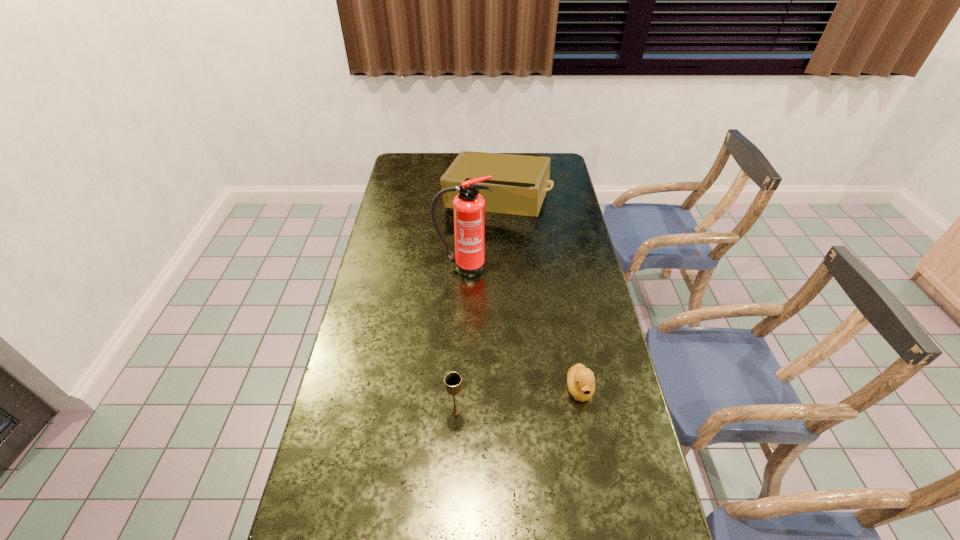
Image resolution: width=960 pixels, height=540 pixels. In order to click on the second farthest object in this screenshot , I will do `click(468, 206)`.

At what (x,y) coordinates should I click in order to perform the action: click on the tallest object. Please return your answer as a coordinate pair (x, y). This screenshot has height=540, width=960. Looking at the image, I should click on (468, 206).

Image resolution: width=960 pixels, height=540 pixels. What are the coordinates of `box` in the screenshot? It's located at (519, 183).

The width and height of the screenshot is (960, 540). In order to click on chalice in this screenshot , I will do `click(453, 382)`.

Locate an element on the screen. Image resolution: width=960 pixels, height=540 pixels. duckling is located at coordinates (581, 382).

In order to click on vacant space situated at the nozzle of the tallest object in this screenshot , I will do `click(460, 349)`.

The image size is (960, 540). I want to click on free space located 0.320m on the front of the farthest object, so click(501, 284).

I want to click on vacant point located 0.280m on the back of the chalice, so click(459, 326).

The height and width of the screenshot is (540, 960). What are the coordinates of `free spot located facing forward on the duckling` in the screenshot? It's located at (591, 455).

Identify the location of object at the far edge. (519, 183).